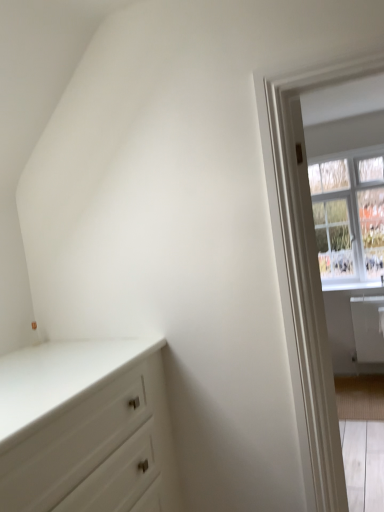
Question: Is white glossy chest of drawers at lower left taller or shorter than white glossy window sill at right?

Choices:
 (A) short
 (B) tall

Answer: (B)

Question: Is white glossy chest of drawers at lower left bigger or smaller than white glossy window sill at right?

Choices:
 (A) small
 (B) big

Answer: (B)

Question: Considering the real-world distances, which object is farthest from the clear glass window at upper right?

Choices:
 (A) white glossy chest of drawers at lower left
 (B) white wooden door at right
 (C) white glossy window sill at right

Answer: (A)

Question: Based on their relative distances, which object is nearer to the white glossy chest of drawers at lower left?

Choices:
 (A) clear glass window at upper right
 (B) white wooden door at right
 (C) white glossy window sill at right

Answer: (B)